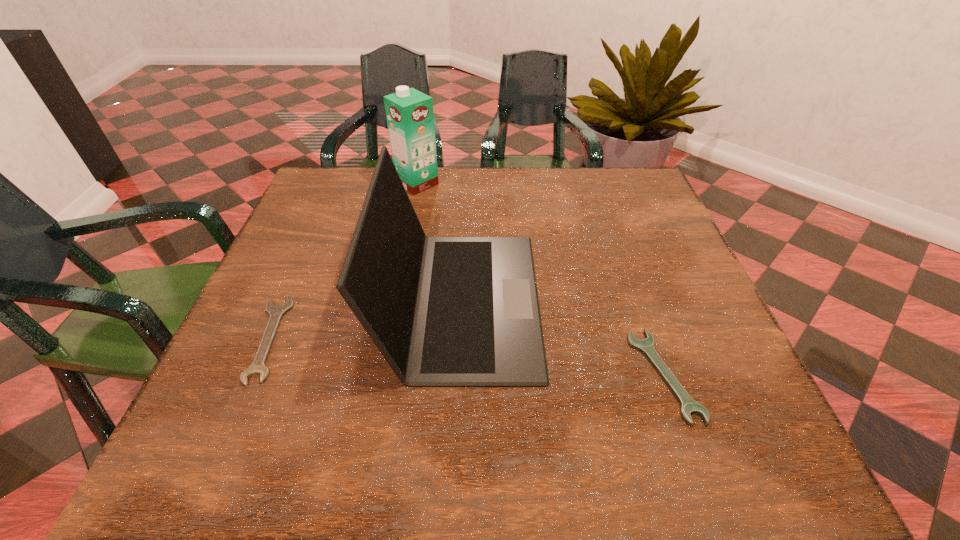
At what (x,y) coordinates should I click in order to perform the action: click on object located in the left edge section of the desktop. Please return your answer as a coordinate pair (x, y). The width and height of the screenshot is (960, 540). Looking at the image, I should click on (276, 312).

The width and height of the screenshot is (960, 540). Find the location of `object located in the right edge section of the desktop`. object located in the right edge section of the desktop is located at coordinates (689, 406).

The height and width of the screenshot is (540, 960). In order to click on object that is at the near right corner in this screenshot , I will do `click(689, 406)`.

Image resolution: width=960 pixels, height=540 pixels. I want to click on vacant region at the far edge, so click(x=537, y=173).

Image resolution: width=960 pixels, height=540 pixels. I want to click on free region at the left edge of the desktop, so click(x=321, y=310).

At what (x,y) coordinates should I click in order to perform the action: click on free space at the right edge of the desktop. Please return your answer as a coordinate pair (x, y). Image resolution: width=960 pixels, height=540 pixels. Looking at the image, I should click on (632, 260).

Locate an element on the screen. vacant space at the near left corner is located at coordinates (250, 426).

You are a GUI agent. You are given a task and a screenshot of the screen. Output one action in this format:
    pyautogui.click(x=<x>, y=<y>)
    Task: Click on the vacant point at the far right corner
    The width and height of the screenshot is (960, 540).
    Given the screenshot: What is the action you would take?
    pyautogui.click(x=630, y=206)

Find the location of a particular element. Image resolution: width=960 pixels, height=540 pixels. free space at the near right corner is located at coordinates (x=696, y=465).

Image resolution: width=960 pixels, height=540 pixels. Find the location of `free space between the leftmost object and the farthest object`. free space between the leftmost object and the farthest object is located at coordinates (343, 261).